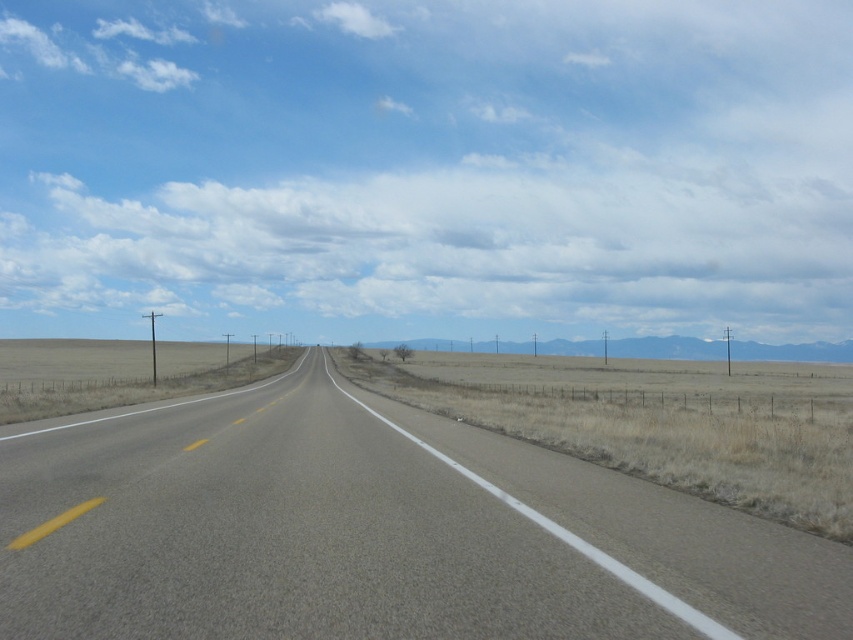
You are driving a car with a width of 2 meters. You see the asphalt road at center. Can your car fit on the road?

The asphalt road at center is located at point (373, 532), so the car can fit on the road as long as it stays within the lane markings.

You are driving a car and see the asphalt road at center and dry grass at center. Which one is more to the left?

The asphalt road at center is positioned on the left side of dry grass at center, so the asphalt road at center is more to the left.

You are a driver who needs to cross the road. The asphalt road at center and dry grass at center are both in your path. Which one is shorter in height?

The asphalt road at center is not as tall as dry grass at center, so the asphalt road at center is shorter in height.